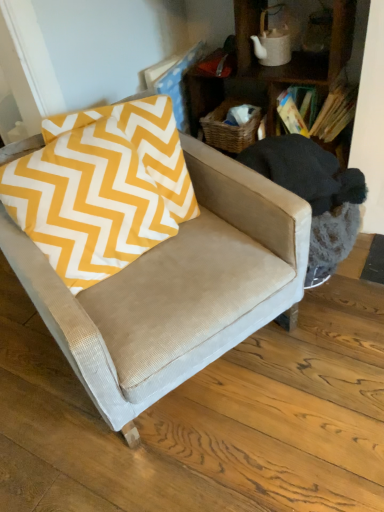
Question: From a real-world perspective, is suede-like beige armchair at center above or below wooden bookshelf at upper right?

Choices:
 (A) above
 (B) below

Answer: (B)

Question: From the image's perspective, is suede-like beige armchair at center above or below wooden bookshelf at upper right?

Choices:
 (A) below
 (B) above

Answer: (A)

Question: Estimate the real-world distances between objects in this image. Which object is farther from the wooden bookshelf at upper right?

Choices:
 (A) suede-like beige swivel chair at center
 (B) yellow zigzag fabric pillow at left
 (C) suede-like beige armchair at center

Answer: (C)

Question: Based on their relative distances, which object is nearer to the yellow zigzag fabric pillow at left?

Choices:
 (A) wooden bookshelf at upper right
 (B) suede-like beige armchair at center
 (C) suede-like beige swivel chair at center

Answer: (B)